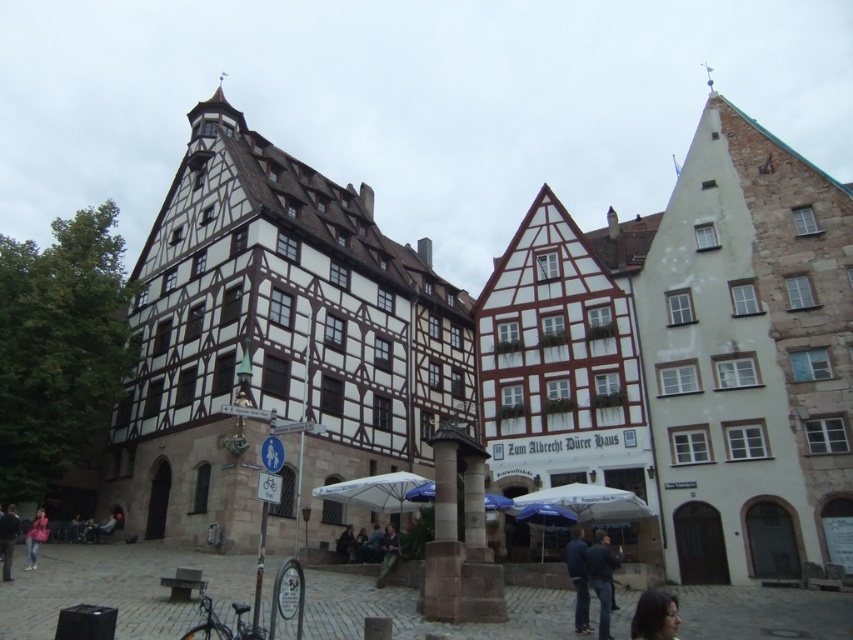
You are a tourist standing in the European town square described. You notice a person wearing a dark green fabric jacket at center and dark blue jeans at center. Which clothing item is positioned higher on their body?

The dark green fabric jacket at center is located above the dark blue jeans at center, so the jacket is positioned higher on their body.

You are a tourist in the European town square and want to take a photo of the historic buildings. You notice a person wearing a dark blue jacket at lower right and dark blue jeans at center. Which clothing item is closer to you?

The dark blue jacket at lower right is closer to you because it is in front of the dark blue jeans at center.